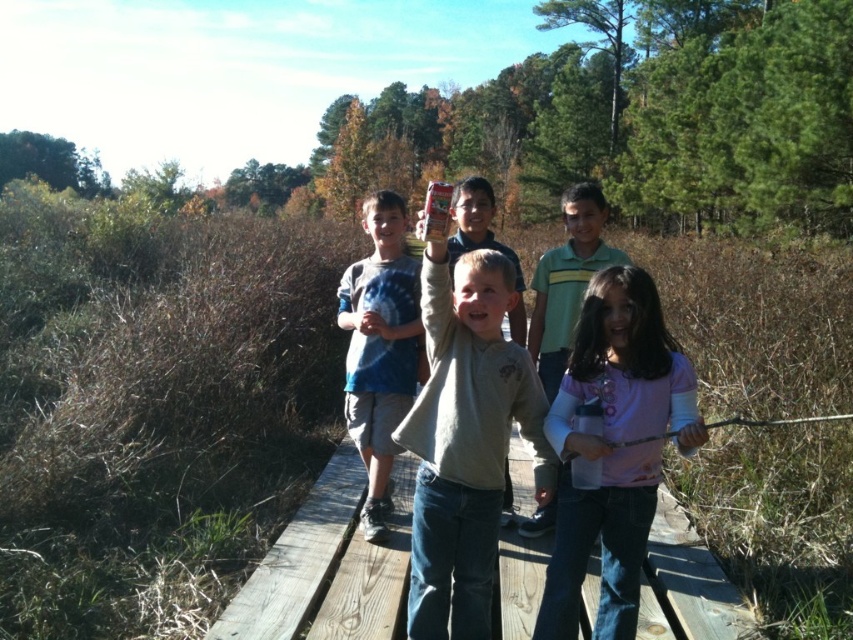
Question: Which point is farther to the camera?

Choices:
 (A) tie-dye t-shirt at center
 (B) pink fleece shirt at center
 (C) wooden plank at center
 (D) light gray cotton shirt at center

Answer: (A)

Question: Is wooden plank at center above pink fleece shirt at center?

Choices:
 (A) no
 (B) yes

Answer: (A)

Question: Does wooden plank at center lie in front of tie-dye t-shirt at center?

Choices:
 (A) no
 (B) yes

Answer: (B)

Question: Is wooden plank at center above tie-dye t-shirt at center?

Choices:
 (A) no
 (B) yes

Answer: (A)

Question: Based on their relative distances, which object is farther from the light gray cotton shirt at center?

Choices:
 (A) wooden plank at center
 (B) pink fleece shirt at center

Answer: (A)

Question: Among these objects, which one is farthest from the camera?

Choices:
 (A) light gray cotton shirt at center
 (B) tie-dye t-shirt at center
 (C) wooden plank at center
 (D) pink fleece shirt at center

Answer: (B)